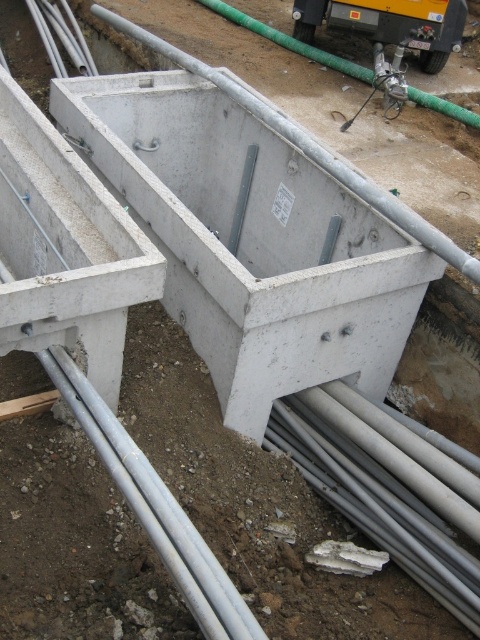
Is silver metallic pipes at lower center shorter than concrete at center?

Yes.

At what (x,y) coordinates should I click in order to perform the action: click on silver metallic pipes at lower center. Please return your answer as a coordinate pair (x, y). The image size is (480, 640). Looking at the image, I should click on (155, 508).

Is silver metallic pipes at lower center taller than matte green hose at upper right?

Yes, silver metallic pipes at lower center is taller than matte green hose at upper right.

Between point (162, 512) and point (406, 6), which one is positioned behind?

Positioned behind is point (406, 6).

Is point (184, 573) farther from viewer compared to point (339, 3)?

That is False.

Locate an element on the screen. silver metallic pipes at lower center is located at coordinates (155, 508).

Is concrete at center thinner than matte green hose at upper right?

Incorrect, concrete at center's width is not less than matte green hose at upper right's.

Can you confirm if concrete at center is positioned to the right of matte green hose at upper right?

No, concrete at center is not to the right of matte green hose at upper right.

Image resolution: width=480 pixels, height=640 pixels. What are the coordinates of `concrete at center` in the screenshot? It's located at (305, 147).

Where is `concrete at center`? This screenshot has height=640, width=480. concrete at center is located at coordinates (305, 147).